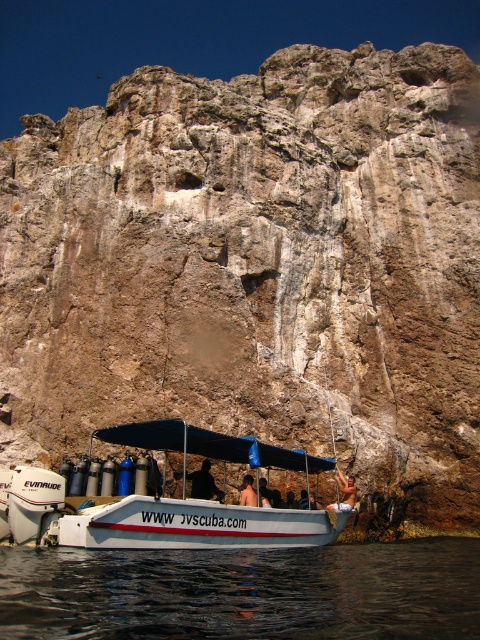
You are a photographer standing on the cliff and want to capture both the black matte person at center and the smooth skin person at center in a single photo. Which person will appear closer to the top of the photo?

The black matte person at center will appear closer to the top of the photo because they are located above the smooth skin person at center.

What is the position of the transparent water at lower center relative to the black matte person at center?

The transparent water at lower center is located to the right of the black matte person at center.